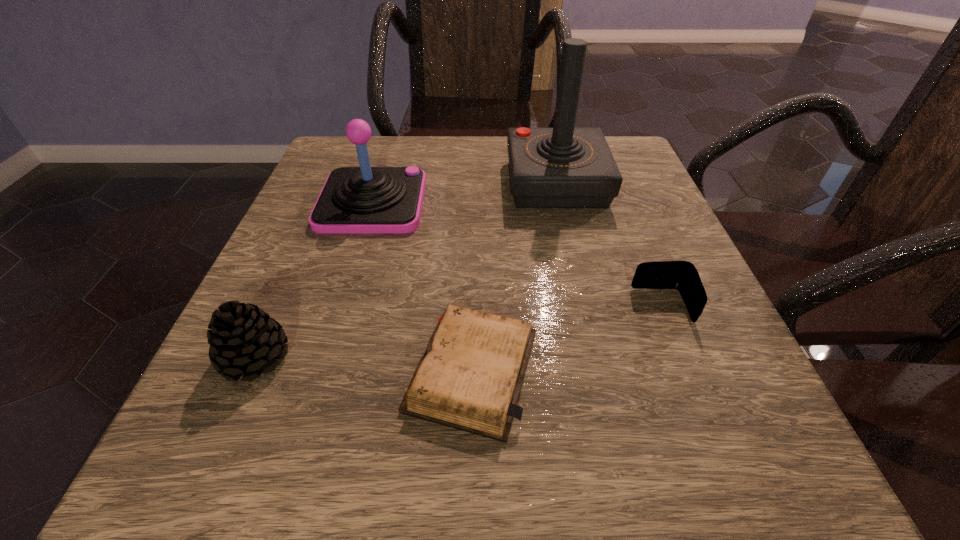
Where is `vacant space located on the outer surface of the second shortest object`? Image resolution: width=960 pixels, height=540 pixels. vacant space located on the outer surface of the second shortest object is located at coordinates (523, 306).

At what (x,y) coordinates should I click in order to perform the action: click on vacant region located on the outer surface of the second shortest object. Please return your answer as a coordinate pair (x, y). Looking at the image, I should click on (569, 306).

Locate an element on the screen. This screenshot has height=540, width=960. free point located on the outer surface of the second shortest object is located at coordinates (490, 306).

Locate an element on the screen. free region located on the right of the shortest object is located at coordinates (645, 370).

Where is `object present at the near edge`? The height and width of the screenshot is (540, 960). object present at the near edge is located at coordinates (470, 376).

Locate an element on the screen. joystick that is at the left edge is located at coordinates pos(354,200).

Identify the location of pinecone that is at the left edge. click(x=243, y=339).

The height and width of the screenshot is (540, 960). I want to click on joystick that is at the right edge, so (x=561, y=167).

Find the location of a particular element. The width and height of the screenshot is (960, 540). wallet at the right edge is located at coordinates (682, 275).

Identify the location of object that is at the far left corner. (354, 200).